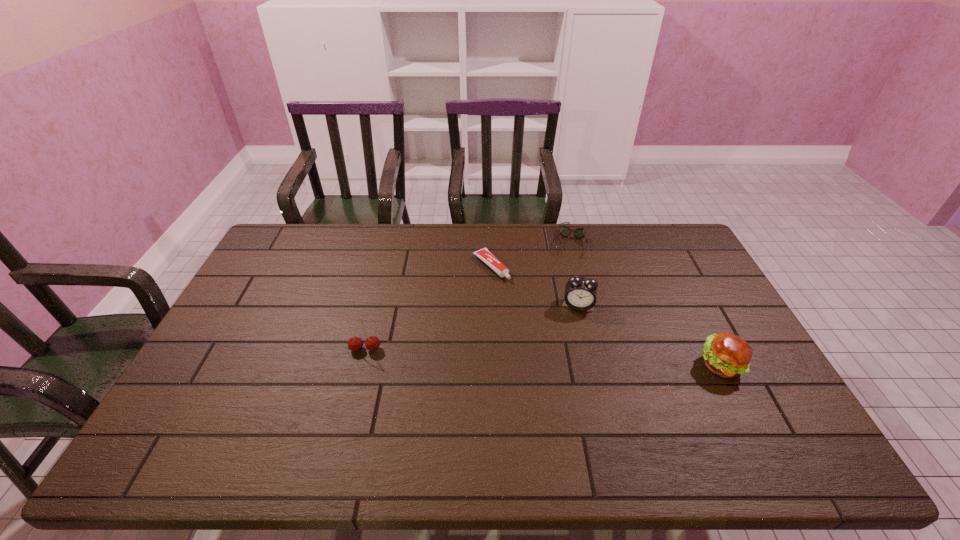
Where is `vacant space on the desktop that is between the cherry and the hamburger and is positioned at the nozzle of the shortest object`? Image resolution: width=960 pixels, height=540 pixels. vacant space on the desktop that is between the cherry and the hamburger and is positioned at the nozzle of the shortest object is located at coordinates (591, 359).

The image size is (960, 540). I want to click on free space on the desktop that is between the leftmost object and the hamburger and is positioned on the front-facing side of the second shortest object, so click(557, 358).

Locate an element on the screen. The width and height of the screenshot is (960, 540). vacant space on the desktop that is between the cherry and the third shortest object and is positioned on the front side of the alarm clock is located at coordinates (577, 359).